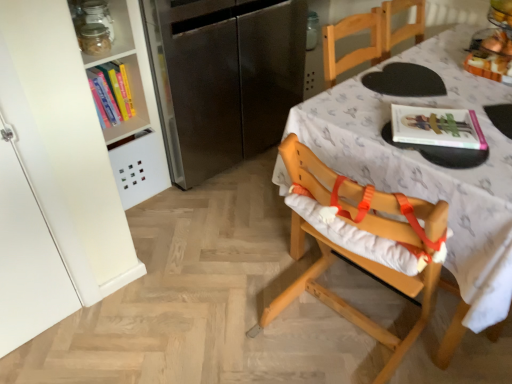
I want to click on vacant space to the left of wooden table at center, so click(x=210, y=264).